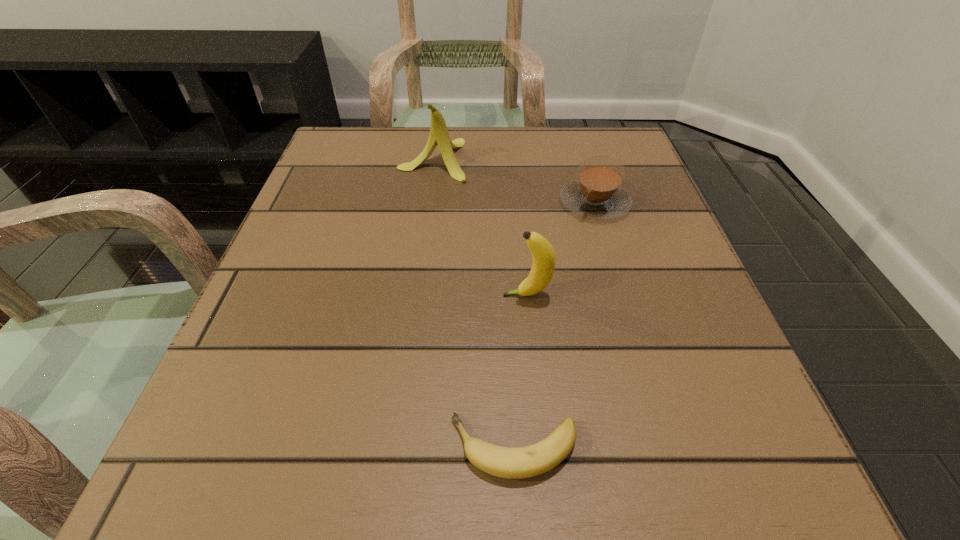
The image size is (960, 540). Find the location of `vacant space at the near edge`. vacant space at the near edge is located at coordinates coord(541,487).

In the image, there is a desktop. Where is `vacant space at the left edge`? This screenshot has height=540, width=960. vacant space at the left edge is located at coordinates (320, 241).

Where is `blank space at the right edge`? blank space at the right edge is located at coordinates (649, 276).

This screenshot has width=960, height=540. Identify the location of free spot at the near right corner of the desktop. (637, 446).

The width and height of the screenshot is (960, 540). What are the coordinates of `unoccupied position between the farthest banana and the third farthest object` in the screenshot? It's located at (480, 227).

At what (x,y) coordinates should I click in order to perform the action: click on vacant area that lies between the second nearest banana and the cappuccino. Please return your answer as a coordinate pair (x, y). The height and width of the screenshot is (540, 960). Looking at the image, I should click on (561, 248).

The image size is (960, 540). What are the coordinates of `free area in between the third farthest object and the nearest banana` in the screenshot? It's located at (520, 372).

Where is `vacant space that's between the nearest object and the second nearest banana`? This screenshot has width=960, height=540. vacant space that's between the nearest object and the second nearest banana is located at coordinates (x=520, y=372).

Where is `free spot between the farthest banana and the cappuccino`? The width and height of the screenshot is (960, 540). free spot between the farthest banana and the cappuccino is located at coordinates (514, 181).

Find the location of a particular element. The width and height of the screenshot is (960, 540). vacant space in between the cappuccino and the farthest banana is located at coordinates (514, 181).